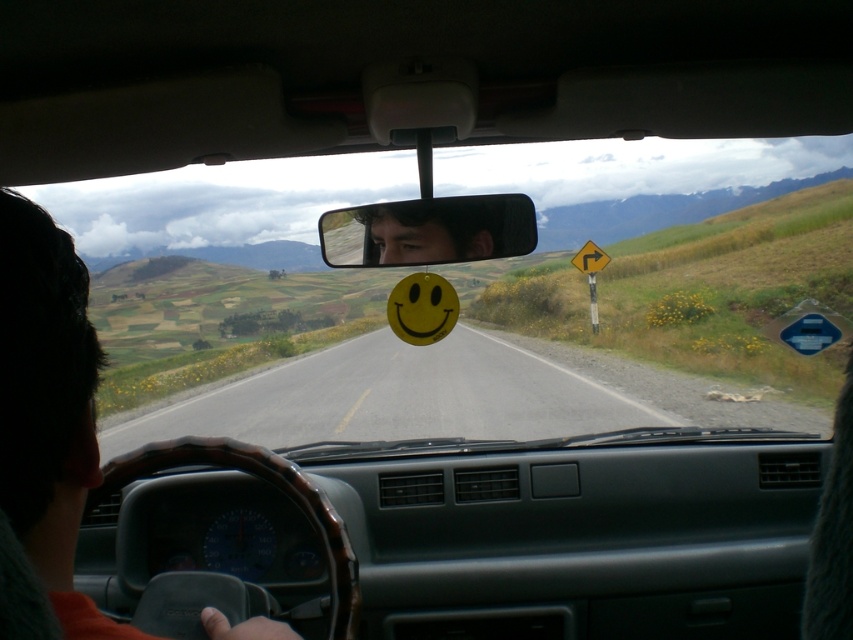
You are a passenger in the car and want to take a photo of the smooth skin face at center without blocking the view of the brown leather steering wheel at lower left. Is it possible to do so?

The brown leather steering wheel at lower left is larger in size than the smooth skin face at center. Since the steering wheel is larger, it might block part of the face if positioned directly in front. However, since the face is at the center and the steering wheel is at the lower left, you can position the camera slightly above or to the right of the steering wheel to capture the face without obstruction.

You are a passenger in the car and want to know if the smooth asphalt road at center is closer to you than the matte plastic mirror at center. Which object is closer?

The matte plastic mirror at center is closer to you because the smooth asphalt road at center is further away.